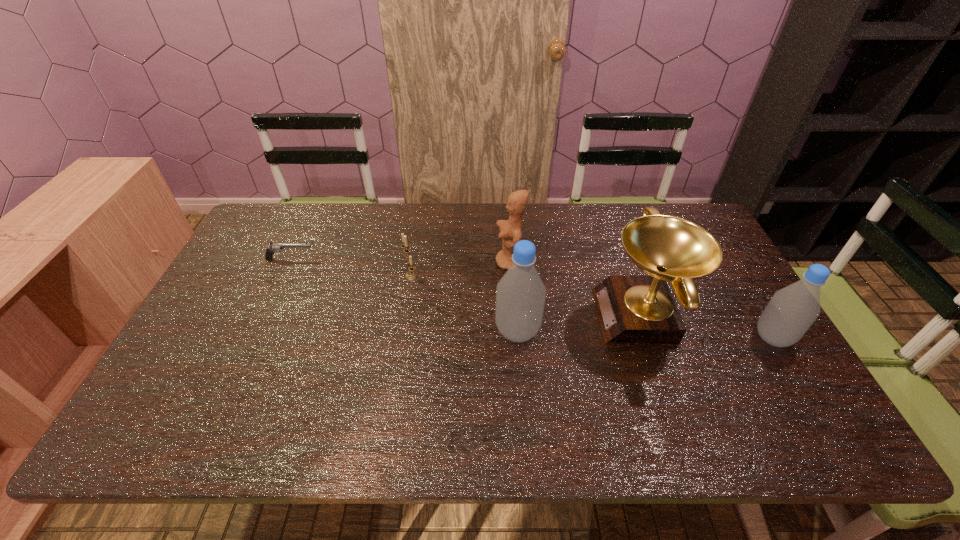
Considering the uniform spacing of bottles, where should an additional bottle be positioned on the left? Please locate a free spot. Please provide its 2D coordinates. Your answer should be formatted as a tuple, i.e. [(x, y)], where the tuple contains the x and y coordinates of a point satisfying the conditions above.

[(269, 325)]